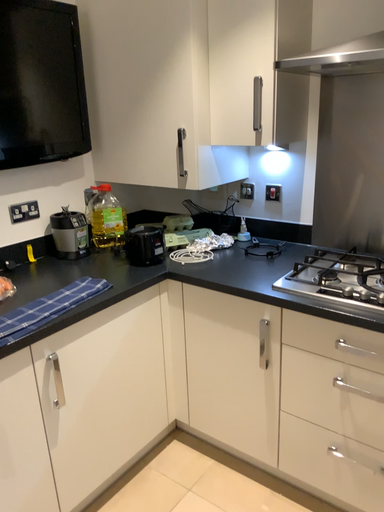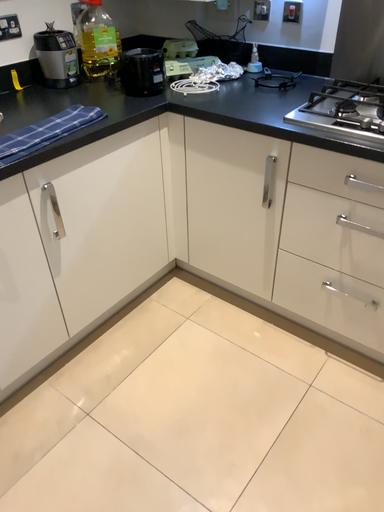
Question: How did the camera likely rotate when shooting the video?

Choices:
 (A) rotated upward
 (B) rotated downward

Answer: (B)